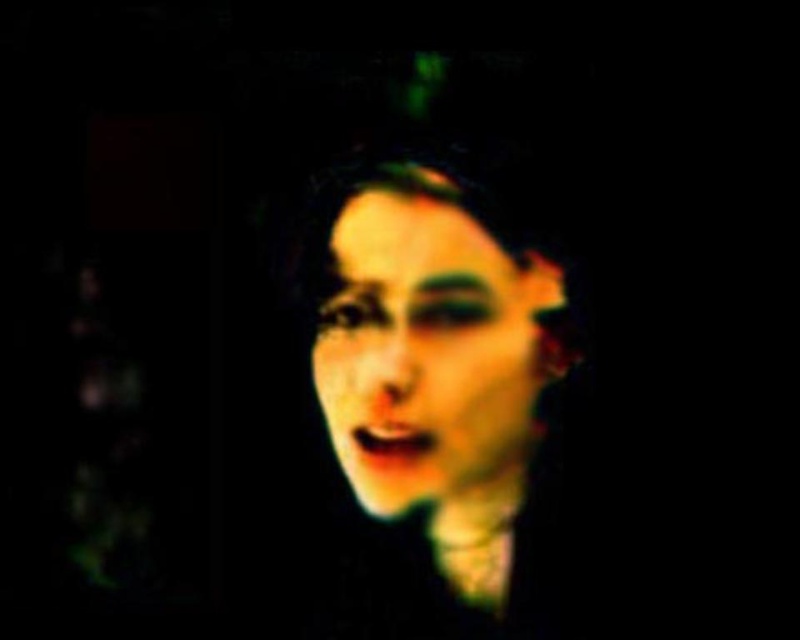
Based on the scene description, which object has a greater width between the matte black face at center and the matte green face at center?

The matte black face at center has a greater width than the matte green face at center according to the description.

You are a photographer analyzing this image. You notice two faces at the center, one labeled as matte black face at center and the other as matte green face at center. According to the scene, which face is closer to the camera?

The matte black face at center is in front of the matte green face at center, so the matte black face at center is closer to the camera.